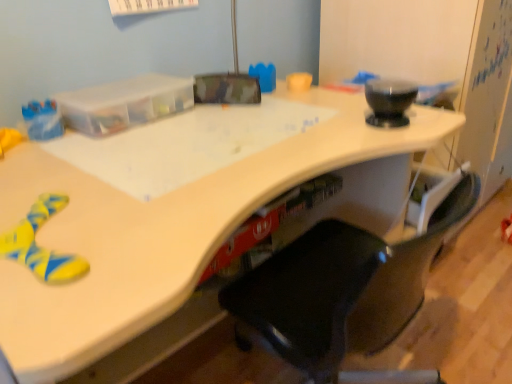
Locate an element on the screen. vacant area that lies between black plastic chair at center and rubberized red toy at lower right is located at coordinates (463, 295).